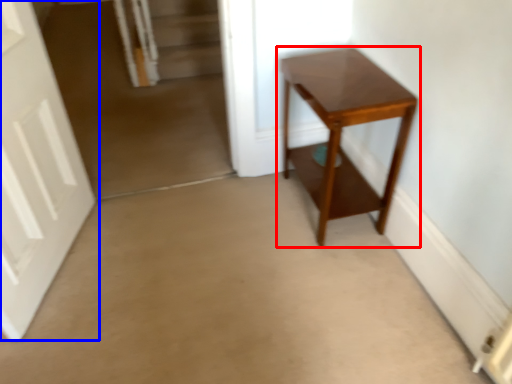
Question: Which point is further to the camera, table (highlighted by a red box) or door (highlighted by a blue box)?

Choices:
 (A) table
 (B) door

Answer: (A)